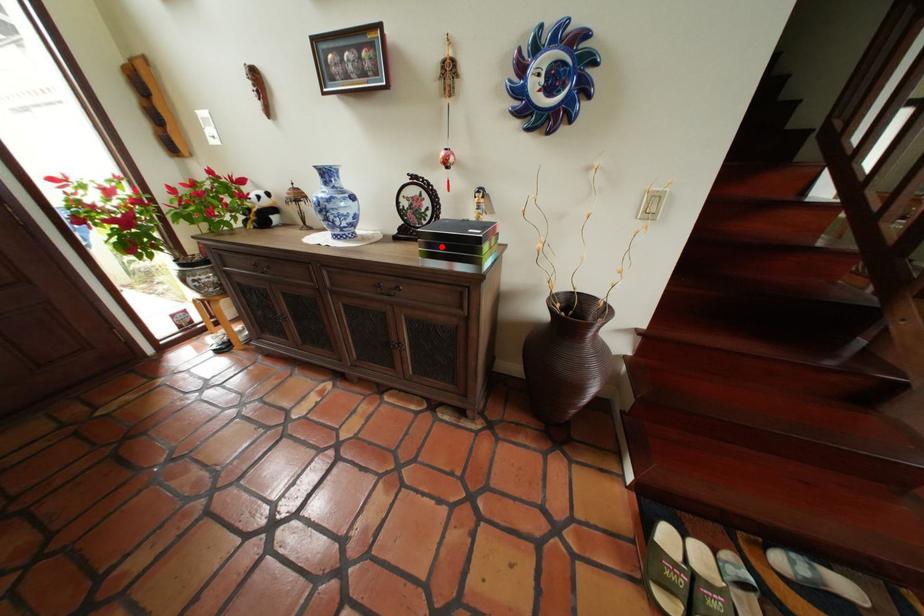
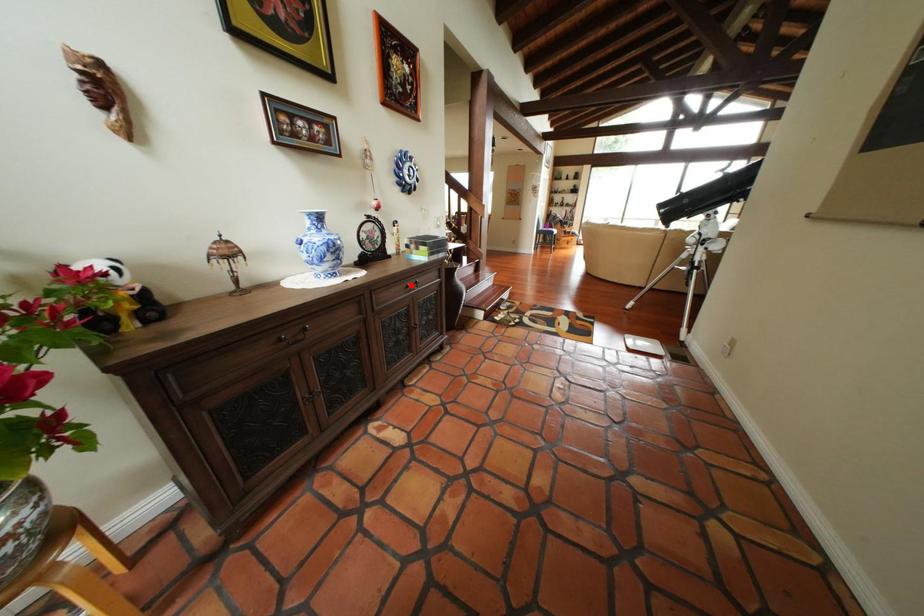
I am providing you with two images of the same scene from different viewpoints. A red point is marked on the first image and another point is marked on the second image. Do the highlighted points in image1 and image2 indicate the same real-world spot?

No